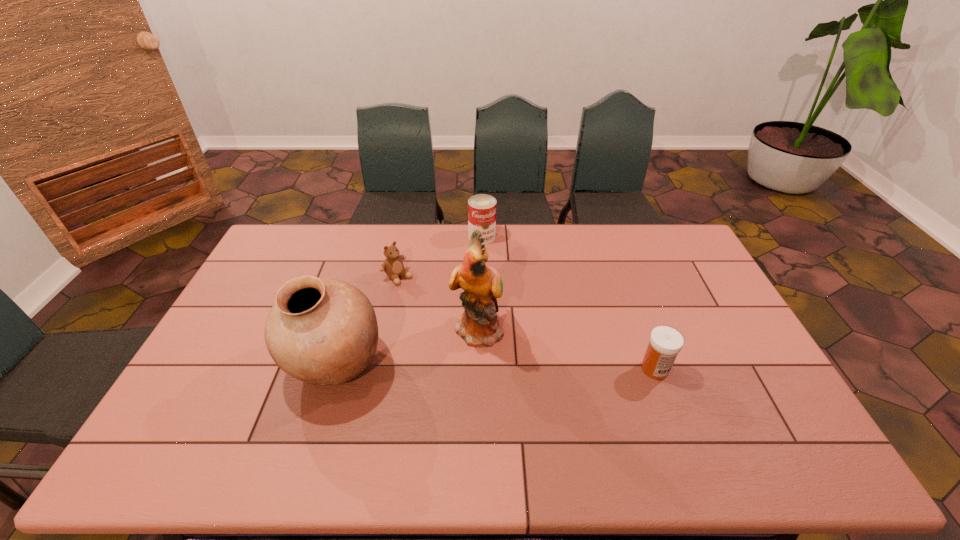
Where is `pottery`? This screenshot has width=960, height=540. pottery is located at coordinates (323, 332).

What are the coordinates of `medicine` in the screenshot? It's located at (665, 343).

Locate an element on the screen. This screenshot has width=960, height=540. the second farthest object is located at coordinates [x=393, y=266].

Where is `parrot`? parrot is located at coordinates (482, 285).

You are a GUI agent. You are given a task and a screenshot of the screen. Output one action in this format:
    pyautogui.click(x=<x>, y=<y>)
    Task: Click on the can
    This screenshot has height=540, width=960.
    Given the screenshot: What is the action you would take?
    pos(481,208)

This screenshot has width=960, height=540. In order to click on the third shortest object in this screenshot , I will do (481, 208).

Identify the location of free space located 0.400m on the right of the pottery. Image resolution: width=960 pixels, height=540 pixels. (525, 364).

You are a GUI agent. You are given a task and a screenshot of the screen. Output one action in this format:
    pyautogui.click(x=<x>, y=<y>)
    Task: Click on the free spot located on the back of the medicine
    The width and height of the screenshot is (960, 540).
    Given the screenshot: What is the action you would take?
    point(632,306)

The height and width of the screenshot is (540, 960). Find the location of `vacant space positioned 0.120m on the front-facing side of the teddy bear`. vacant space positioned 0.120m on the front-facing side of the teddy bear is located at coordinates (429, 301).

Find the location of a particular element. The height and width of the screenshot is (540, 960). vacant space located 0.110m on the front-facing side of the teddy bear is located at coordinates (427, 300).